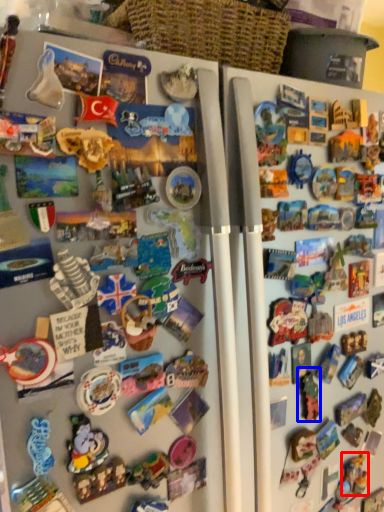
Question: Which object appears closest to the camera in this image, toy (highlighted by a red box) or toy (highlighted by a blue box)?

Choices:
 (A) toy
 (B) toy

Answer: (B)